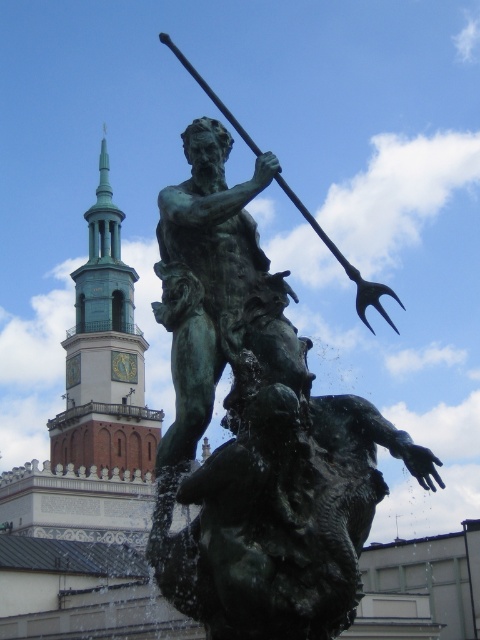
Does green patina bronze statue at center appear on the left side of green patina tower at upper left?

In fact, green patina bronze statue at center is to the right of green patina tower at upper left.

Who is more distant from viewer, (x=200, y=436) or (x=139, y=403)?

Point (x=139, y=403)

This screenshot has height=640, width=480. I want to click on green patina bronze statue at center, so click(255, 428).